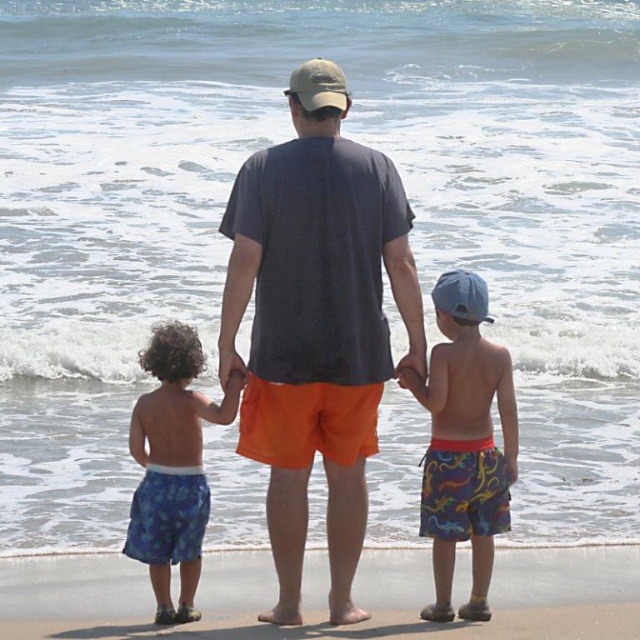
Can you confirm if orange cotton shorts at center is taller than blue printed shorts at left?

Incorrect, orange cotton shorts at center's height is not larger of blue printed shorts at left's.

Is the position of orange cotton shorts at center more distant than that of blue printed shorts at left?

Yes, it is.

Who is more forward, (x=348, y=232) or (x=172, y=477)?

Point (x=172, y=477) is in front.

Identify the location of orange cotton shorts at center. Image resolution: width=640 pixels, height=640 pixels. (316, 333).

Who is more distant from viewer, (371, 582) or (340, 104)?

Positioned behind is point (340, 104).

Is sandy beach at lower center positioned behind khaki fabric baseball cap at center?

No, sandy beach at lower center is closer to the viewer.

Locate an element on the screen. The height and width of the screenshot is (640, 640). sandy beach at lower center is located at coordinates (72, 588).

At what (x,y) coordinates should I click in order to perform the action: click on sandy beach at lower center. Please return your answer as a coordinate pair (x, y). This screenshot has height=640, width=640. Looking at the image, I should click on (72, 588).

What do you see at coordinates (317, 84) in the screenshot? The width and height of the screenshot is (640, 640). I see `khaki fabric baseball cap at center` at bounding box center [317, 84].

Does point (298, 86) come behind point (474, 284)?

That is True.

Where is `khaki fabric baseball cap at center`? khaki fabric baseball cap at center is located at coordinates (317, 84).